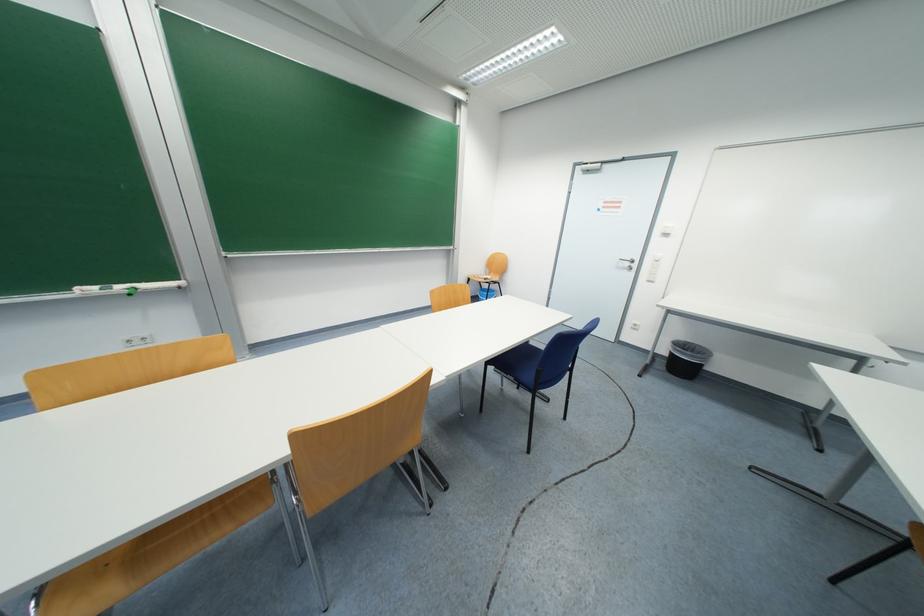
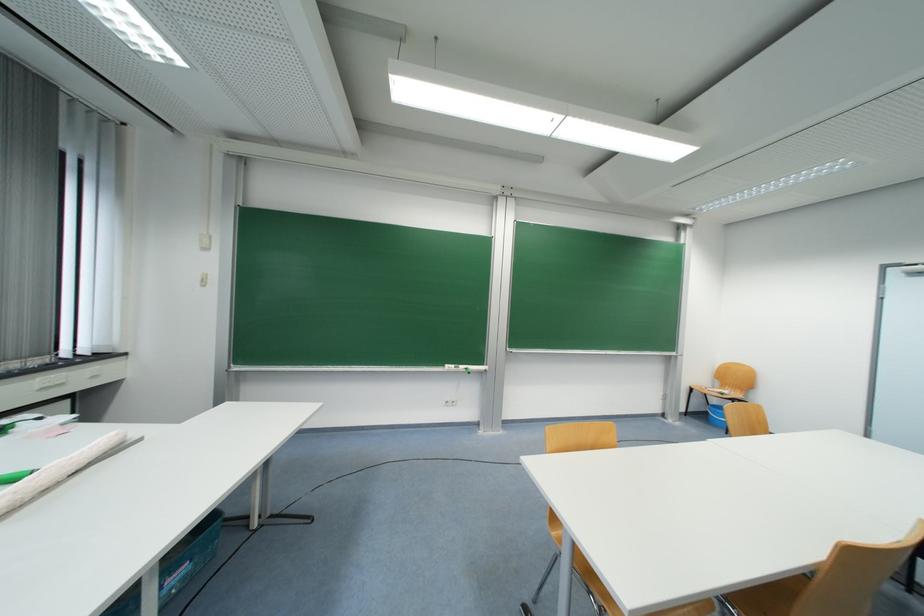
Where in the second image is the point corresponding to point 141,344 from the first image?

(455, 406)